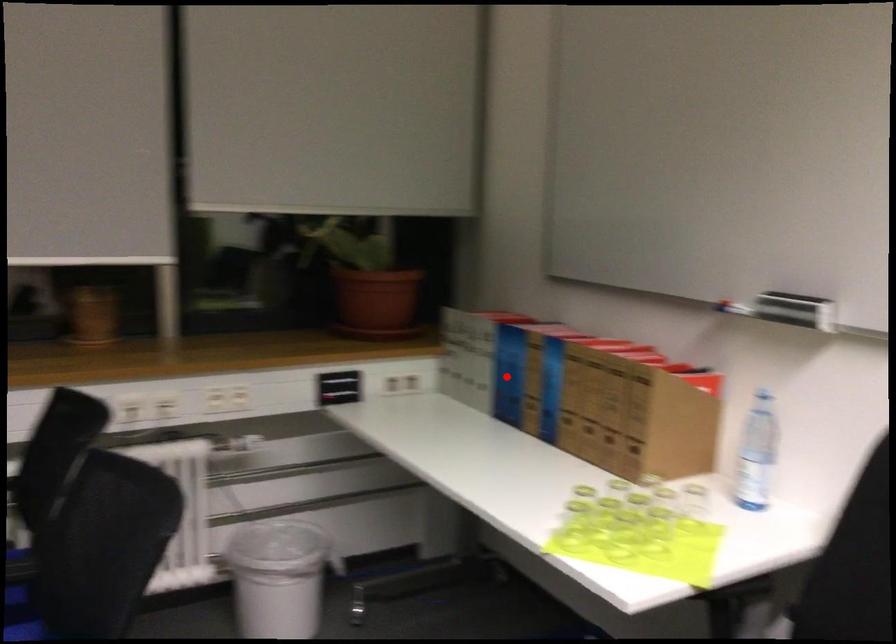
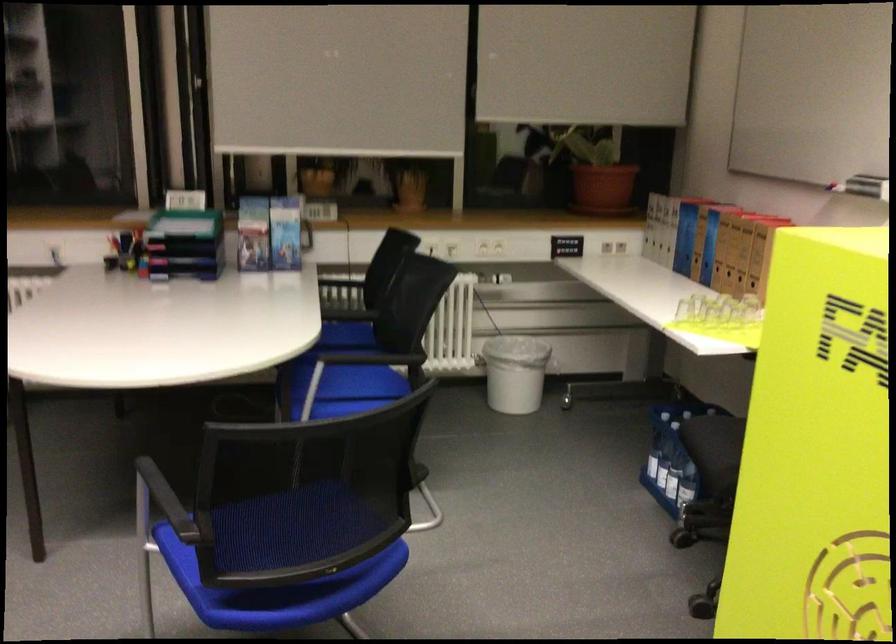
Locate, in the second image, the point that corresponds to the highlighted location in the first image.

(685, 238)